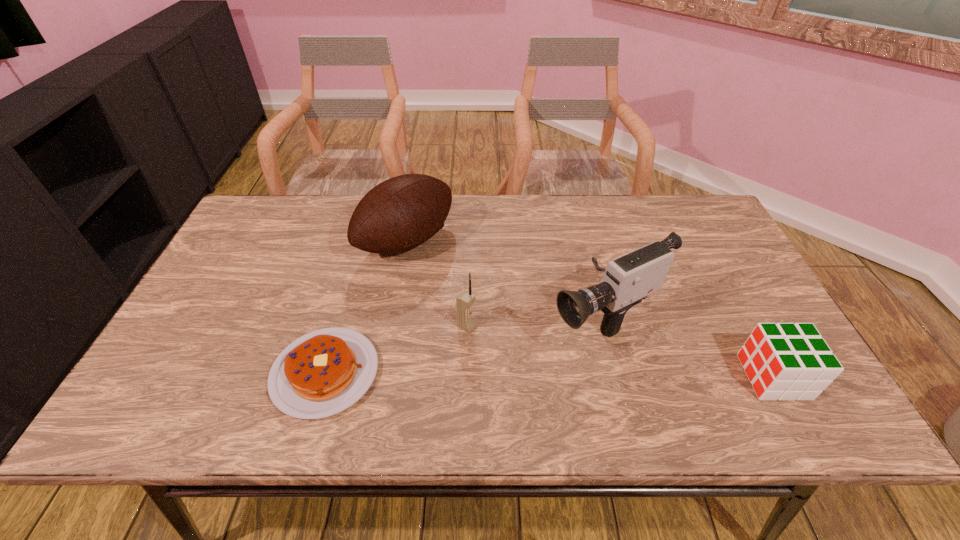
This screenshot has height=540, width=960. Find the location of `the shortest object`. the shortest object is located at coordinates 322,373.

What are the coordinates of `the fourth tallest object` in the screenshot? It's located at (783, 361).

You are a GUI agent. You are given a task and a screenshot of the screen. Output one action in this format:
    pyautogui.click(x=<x>, y=<y>)
    Task: Click on the rightmost object
    
    Given the screenshot: What is the action you would take?
    pyautogui.click(x=783, y=361)

Where is `camcorder`? camcorder is located at coordinates (628, 279).

Where is `the third shortest object`? Image resolution: width=960 pixels, height=540 pixels. the third shortest object is located at coordinates (465, 321).

You are a GUI agent. You are given a task and a screenshot of the screen. Output one action in this format:
    pyautogui.click(x=<x>, y=<y>)
    Task: Click on the third object from left to right
    
    Given the screenshot: What is the action you would take?
    465,321

Where is `football`? This screenshot has width=960, height=540. football is located at coordinates (401, 213).

Locate an element on the screen. This screenshot has width=960, height=540. vacant space located 0.240m on the back of the shortest object is located at coordinates (356, 264).

The height and width of the screenshot is (540, 960). I want to click on vacant point located on the red face of the rightmost object, so click(618, 377).

Locate an element on the screen. The image size is (960, 540). free space located on the red face of the rightmost object is located at coordinates (711, 377).